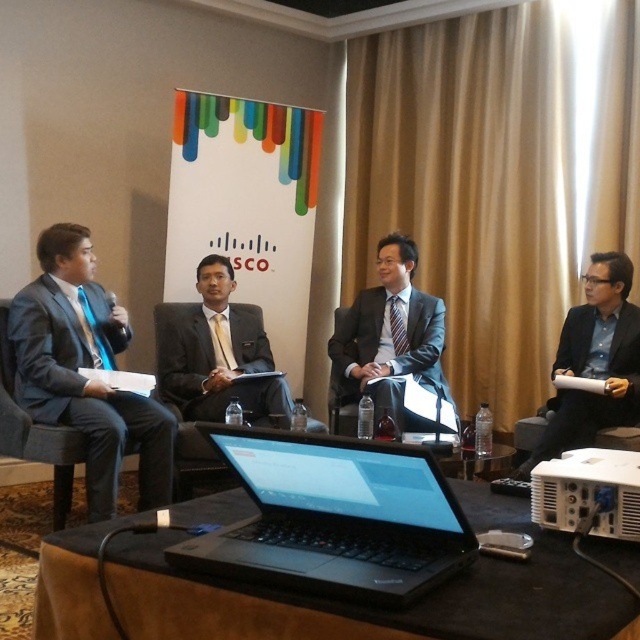
Does matte black suit at left lie in front of matte black suit at center?

Yes, it is.

Who is more distant from viewer, (x=51, y=317) or (x=284, y=413)?

The point (x=284, y=413) is more distant.

Identify the location of matte black suit at left. (86, 400).

You are a GUI agent. You are given a task and a screenshot of the screen. Output one action in this format:
    pyautogui.click(x=<x>, y=<y>)
    Task: Click on the black matte table at center
    The image size is (640, 640).
    Given the screenshot: What is the action you would take?
    pyautogui.click(x=380, y=609)

Identify the location of black matte table at center. (380, 609).

Identify the location of black matte laptop at center. This screenshot has height=640, width=640. (333, 516).

Describe the element at coordinates (333, 516) in the screenshot. The image size is (640, 640). I see `black matte laptop at center` at that location.

Locate an element on the screen. The height and width of the screenshot is (640, 640). black matte laptop at center is located at coordinates (333, 516).